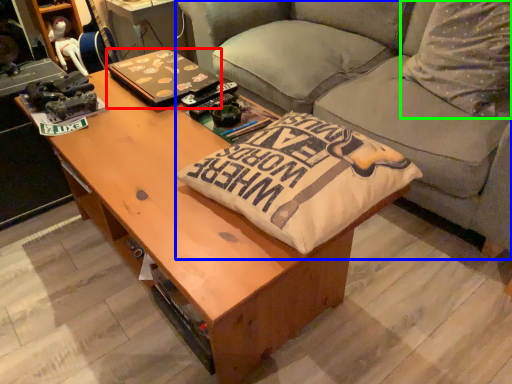
Question: Which is nearer to the laptop (highlighted by a red box)? studio couch (highlighted by a blue box) or throw pillow (highlighted by a green box).

Choices:
 (A) studio couch
 (B) throw pillow

Answer: (A)